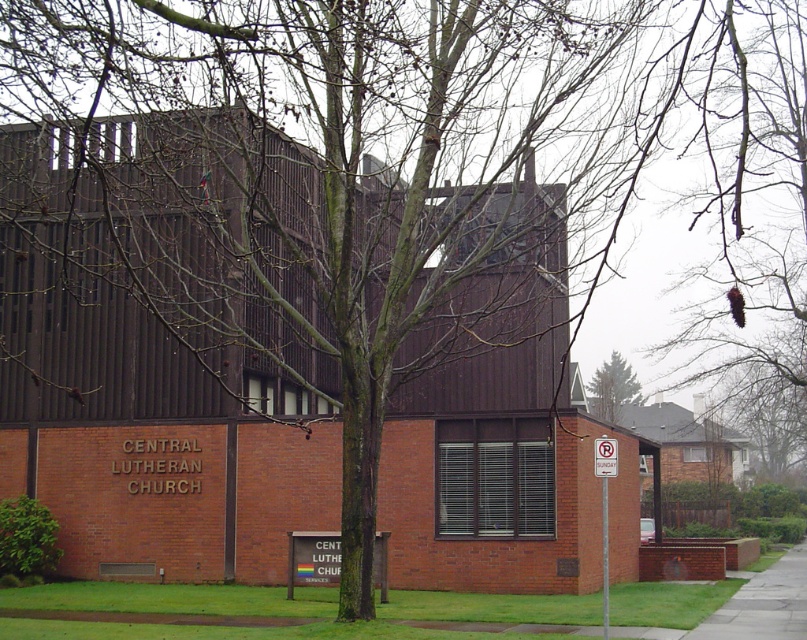
Question: Where is gray concrete sidewalk at lower right located in relation to green coniferous tree at upper center in the image?

Choices:
 (A) below
 (B) above

Answer: (A)

Question: Which point appears closest to the camera in this image?

Choices:
 (A) (759, 582)
 (B) (624, 364)

Answer: (A)

Question: Is gray concrete sidewalk at lower right closer to camera compared to green coniferous tree at upper center?

Choices:
 (A) yes
 (B) no

Answer: (A)

Question: Is gray concrete sidewalk at lower right closer to the viewer compared to green coniferous tree at upper center?

Choices:
 (A) no
 (B) yes

Answer: (B)